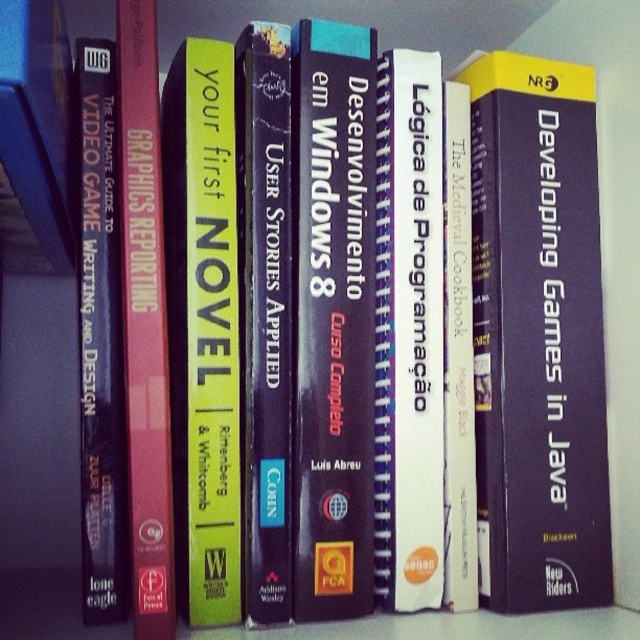
Question: Does matte pink book at center lie in front of white paper at center?

Choices:
 (A) no
 (B) yes

Answer: (B)

Question: Can you confirm if white matte book at center is smaller than matte black book at left?

Choices:
 (A) no
 (B) yes

Answer: (B)

Question: Does yellow matte book at center appear under matte pink book at center?

Choices:
 (A) no
 (B) yes

Answer: (B)

Question: Among these points, which one is farthest from the camera?

Choices:
 (A) click(148, 620)
 (B) click(113, 387)
 (C) click(272, 48)
 (D) click(467, 113)

Answer: (D)

Question: Considering the real-world distances, which object is farthest from the yellow matte book at center?

Choices:
 (A) dark blue hardcover book at center
 (B) purple hardcover book at center

Answer: (B)

Question: Which of the following is the closest to the observer?

Choices:
 (A) (132, 374)
 (B) (284, 568)
 (C) (323, 461)

Answer: (A)